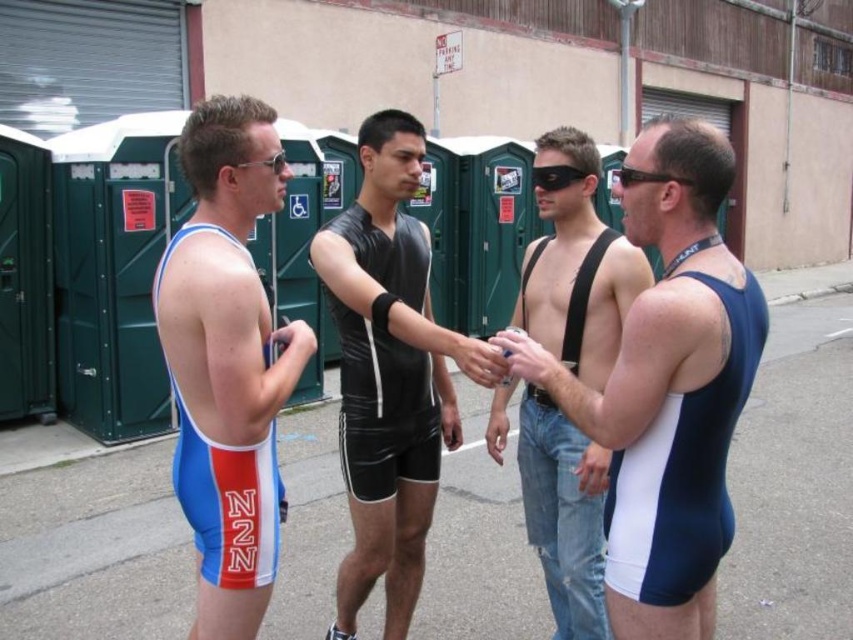
You are a photographer trying to capture a closeup of the shiny black suit at center and the matte black hand at center. If you want to ensure both are in focus, which object should you adjust your camera focus on first?

The shiny black suit at center is wider than the matte black hand at center, so you should focus on the shiny black suit at center first to ensure depth of field covers both.

You are a photographer trying to capture a closeup shot of the denim jeans at center and the matte blue skin at center. Which object should you zoom in on if you want to focus on the wider one?

The denim jeans at center might be wider than matte blue skin at center, so you should zoom in on the denim jeans at center to focus on the wider one.